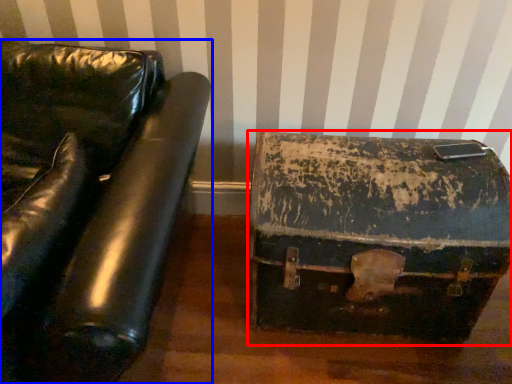
Question: Among these objects, which one is nearest to the camera, suitcase (highlighted by a red box) or furniture (highlighted by a blue box)?

Choices:
 (A) suitcase
 (B) furniture

Answer: (B)